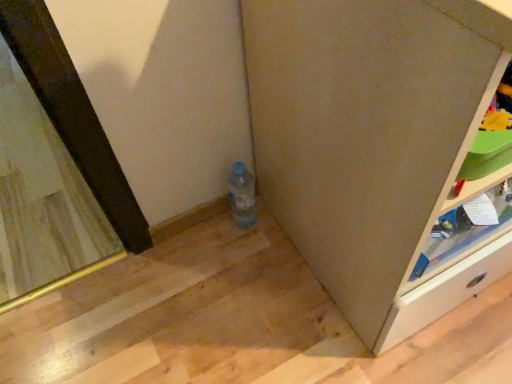
Question: Considering the positions of matte gray cabinet at lower right and wooden frame mirror at left in the image, is matte gray cabinet at lower right bigger or smaller than wooden frame mirror at left?

Choices:
 (A) small
 (B) big

Answer: (B)

Question: Visually, is matte gray cabinet at lower right positioned to the left or to the right of wooden frame mirror at left?

Choices:
 (A) right
 (B) left

Answer: (A)

Question: Which of these objects is positioned farthest from the matte gray cabinet at lower right?

Choices:
 (A) light brown wooden shelf at right
 (B) wooden frame mirror at left
 (C) translucent plastic bottle at center

Answer: (B)

Question: Which is nearer to the light brown wooden shelf at right?

Choices:
 (A) matte gray cabinet at lower right
 (B) translucent plastic bottle at center
 (C) wooden frame mirror at left

Answer: (A)